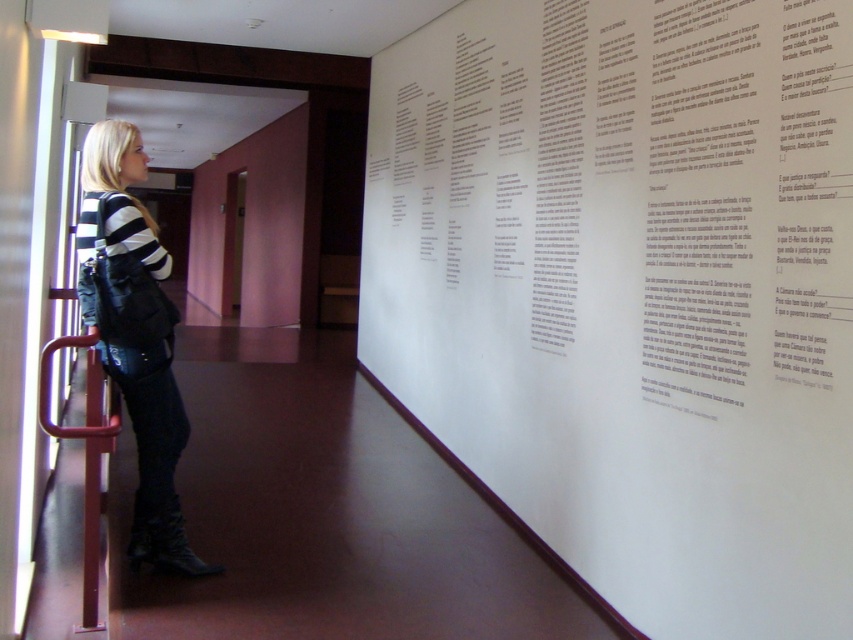
You are a visitor in the museum and you see the black leather boots at lower left and the metallic red handrail at lower left. Which object is closer to you?

The black leather boots at lower left is positioned over the metallic red handrail at lower left, so the boots are closer to you.

You are standing in the museum and see two points marked on the wall. Which point is closer to you, the point at coordinates point (766, 461) or point (149, 493)?

Point (766, 461) is closer to the viewer than point (149, 493).

You are a visitor in the museum and want to take a photo of the informational wall display. You are standing near the black leather boots at lower left and the metallic red handrail at lower left. Which object is closer to you when you look down?

The black leather boots at lower left are closer to you than the metallic red handrail at lower left because they are positioned further to the viewer.